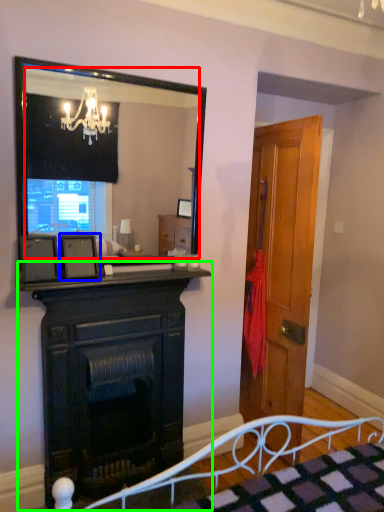
Question: Estimate the real-world distances between objects in this image. Which object is farther from mirror (highlighted by a red box), picture frame (highlighted by a blue box) or fireplace (highlighted by a green box)?

Choices:
 (A) picture frame
 (B) fireplace

Answer: (A)